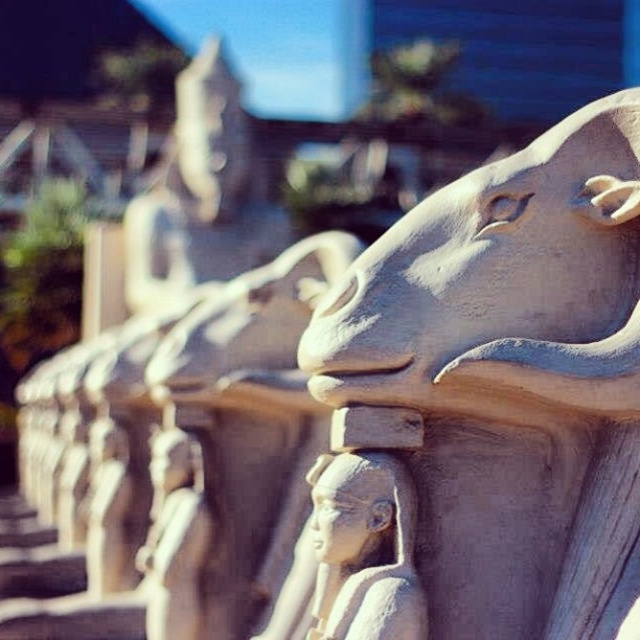
Which is in front, point (579, 556) or point (401, 596)?

Point (401, 596) is more forward.

The height and width of the screenshot is (640, 640). What do you see at coordinates (509, 378) in the screenshot? I see `gray stone bull at center` at bounding box center [509, 378].

This screenshot has width=640, height=640. Identify the location of gray stone bull at center. (x=509, y=378).